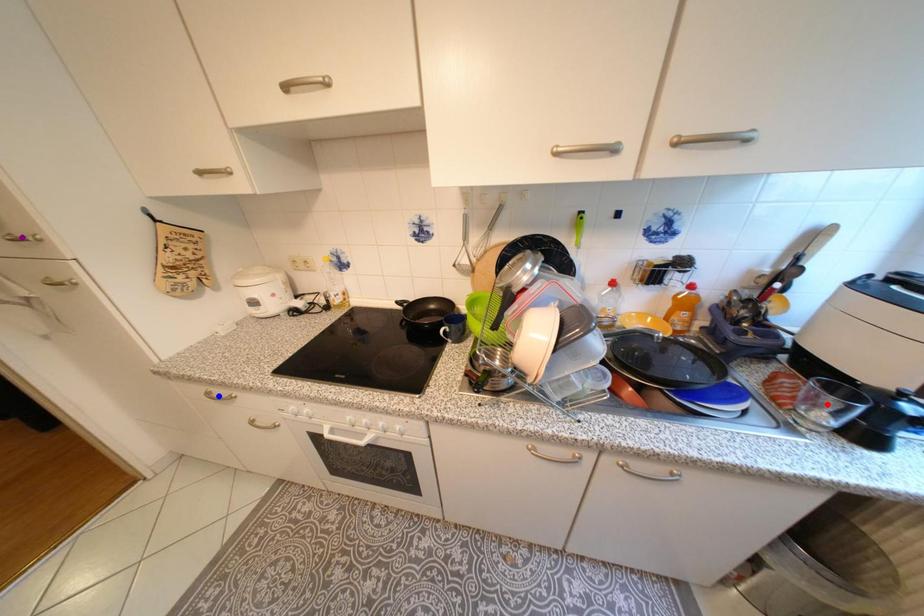
Order these from nearest to farthest:
blue point
red point
purple point

red point, blue point, purple point